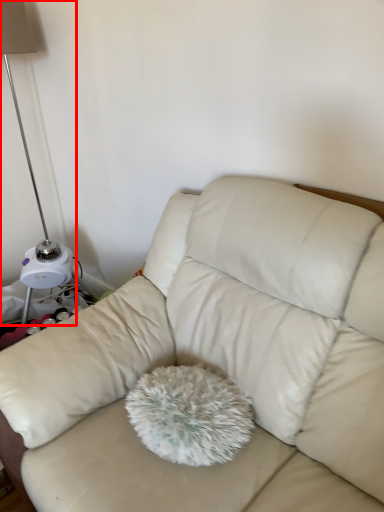
Question: Considering the relative positions of lamp (annotated by the red box) and studio couch in the image provided, where is lamp (annotated by the red box) located with respect to the staircase?

Choices:
 (A) right
 (B) left

Answer: (B)